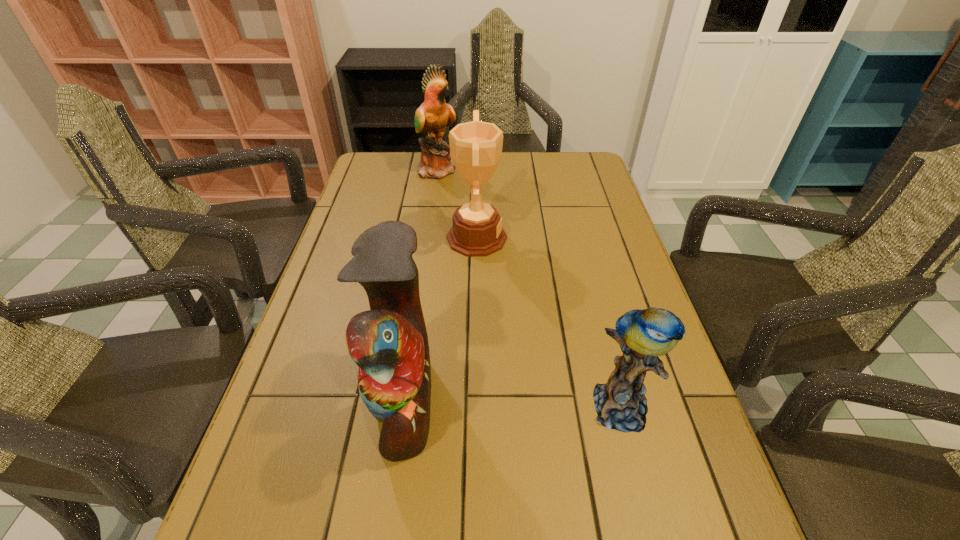
The image size is (960, 540). Identify the location of the farthest object. (431, 118).

Locate an element on the screen. The width and height of the screenshot is (960, 540). award is located at coordinates (476, 147).

I want to click on the rightmost parrot, so click(643, 335).

Identify the location of vacant space located 0.210m on the front-facing side of the farthest object. (519, 170).

Image resolution: width=960 pixels, height=540 pixels. I want to click on free space located on the front-facing side of the second farthest object, so click(x=528, y=238).

The width and height of the screenshot is (960, 540). What are the coordinates of `vacant space located on the face of the rightmost object` in the screenshot? It's located at (649, 516).

This screenshot has height=540, width=960. In order to click on object situated at the far edge in this screenshot , I will do `click(431, 118)`.

Locate an element on the screen. This screenshot has width=960, height=540. object situated at the right edge is located at coordinates (643, 335).

The width and height of the screenshot is (960, 540). I want to click on vacant region at the far edge of the desktop, so click(533, 154).

In the image, there is a desktop. Identify the location of free space at the left edge. This screenshot has height=540, width=960. (308, 393).